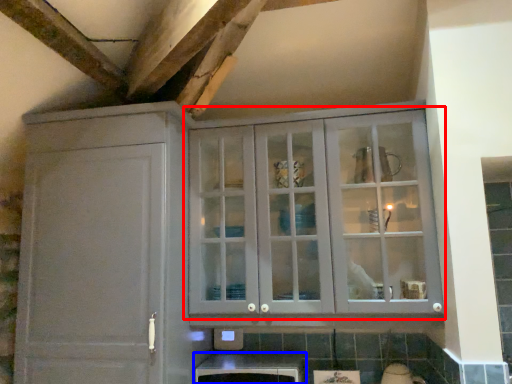
Question: Which point is closer to the camera, cupboard (highlighted by a red box) or cabinetry (highlighted by a blue box)?

Choices:
 (A) cupboard
 (B) cabinetry

Answer: (A)